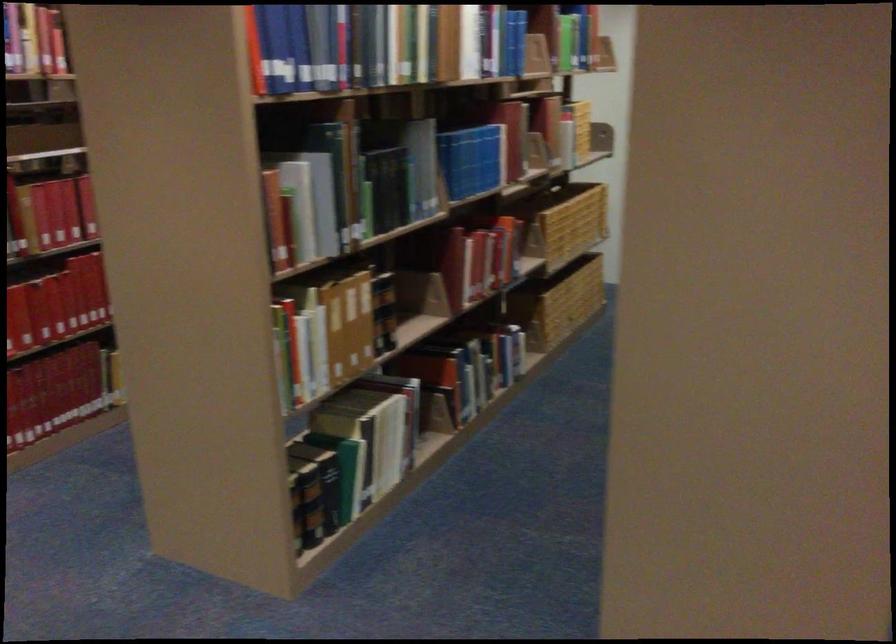
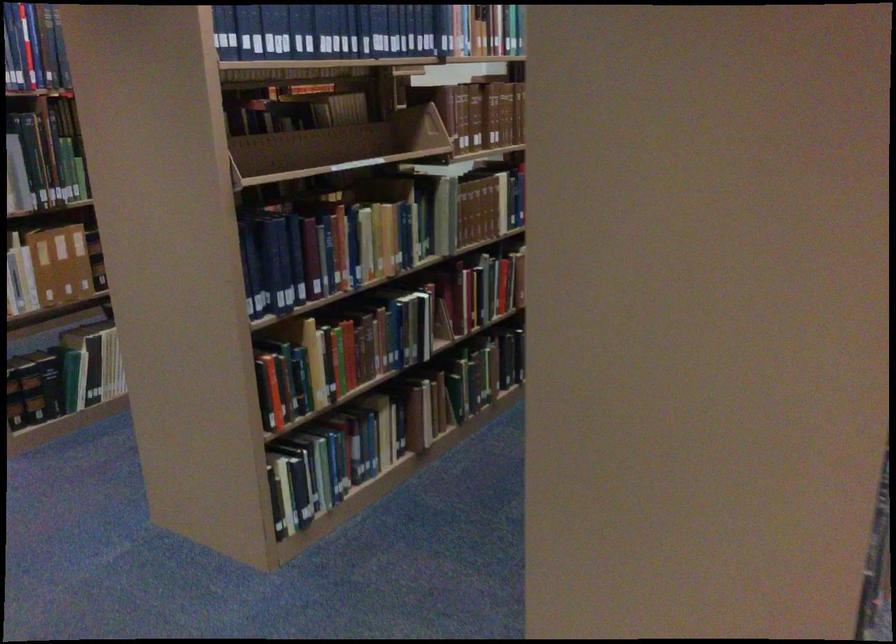
Locate, in the second image, the point that corresponds to point (352, 326) in the first image.

(61, 263)